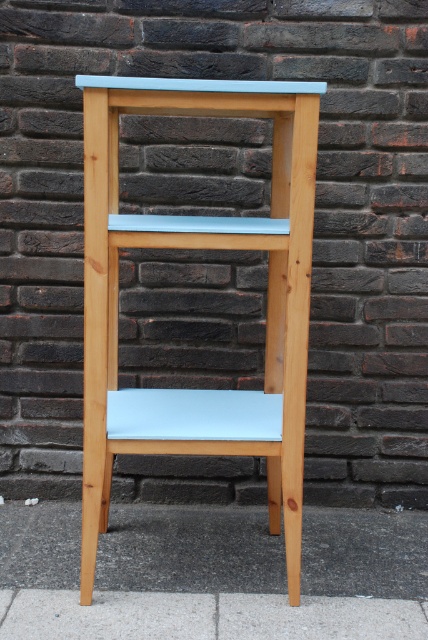
Between light blue matte wood chair at center and gray concrete pavement at lower center, which one appears on the left side from the viewer's perspective?

From the viewer's perspective, light blue matte wood chair at center appears more on the left side.

Does point (202, 218) come behind point (17, 605)?

That is True.

You are a GUI agent. You are given a task and a screenshot of the screen. Output one action in this format:
    pyautogui.click(x=<x>, y=<y>)
    Task: Click on the light blue matte wood chair at center
    
    Given the screenshot: What is the action you would take?
    point(199,248)